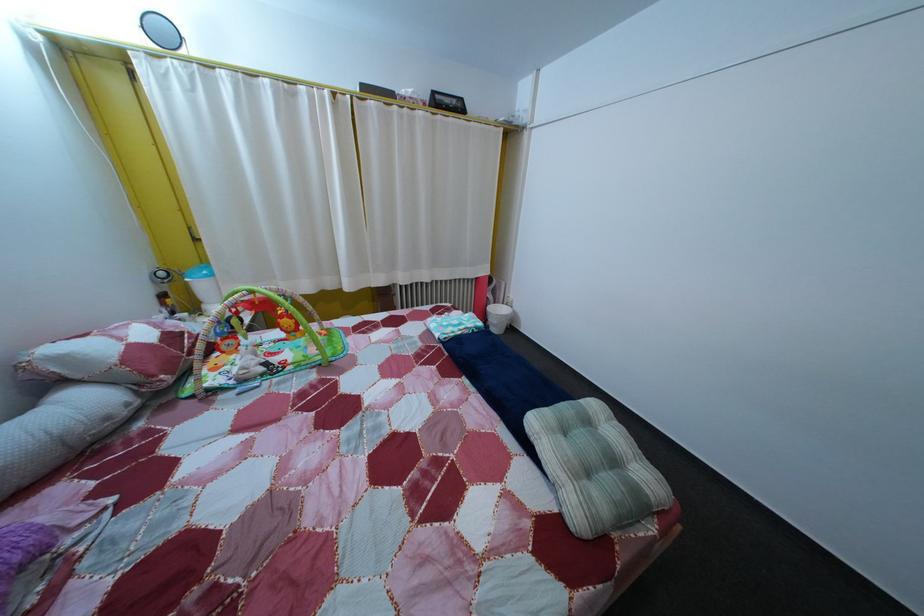
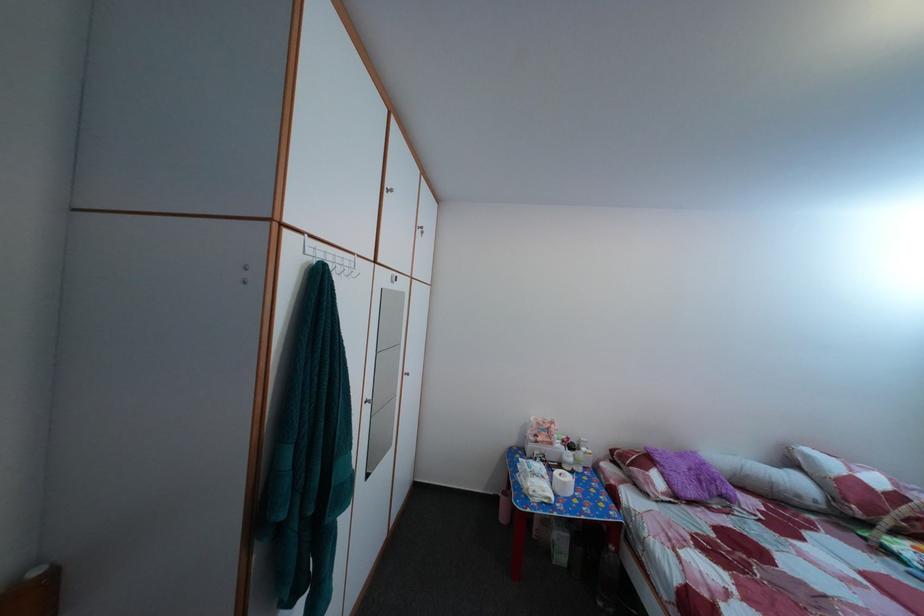
Where in the second image is the point corresponding to pixel 70 366 from the first image?

(817, 464)